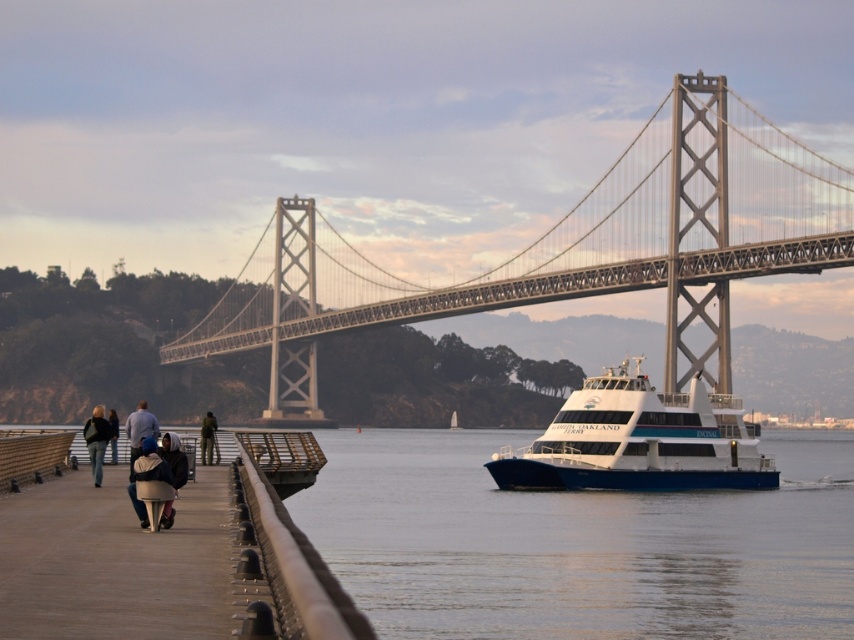
You are a photographer planning to capture a group photo of the people on the pier. You notice the white fabric jacket at lower left and the dark gray jacket at left. Which person should you ask to move closer to the front to ensure they are fully visible in the photo?

You should ask the white fabric jacket at lower left to move closer to the front because it occupies less space and might be partially obscured by the larger dark gray jacket at left.

You are standing on the wooden pier and want to take a photo of the green fabric jacket at left without the metallic gray bridge at center blocking the view. Is this possible?

The green fabric jacket at left is behind the metallic gray bridge at center, so taking a photo of the green fabric jacket at left without the bridge blocking the view is not possible.